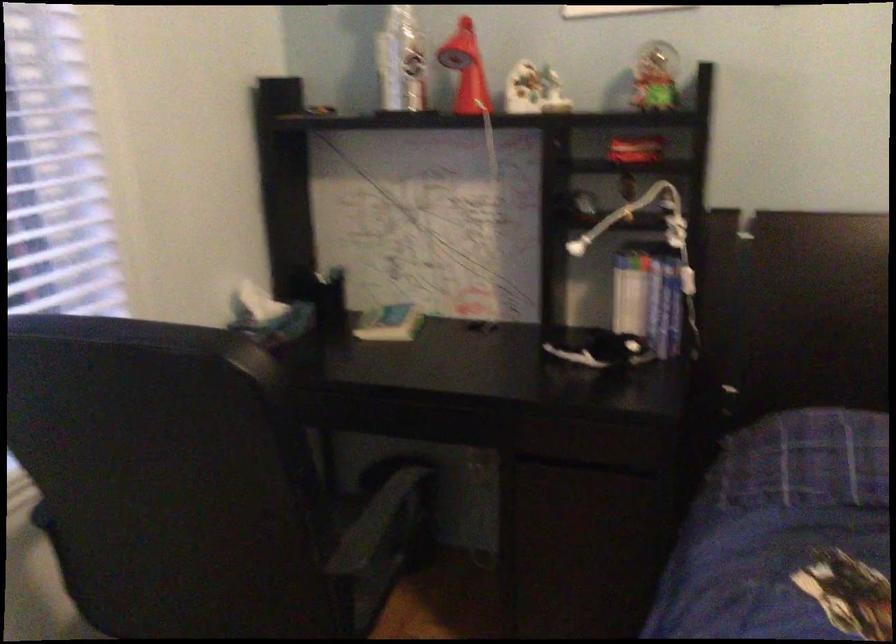
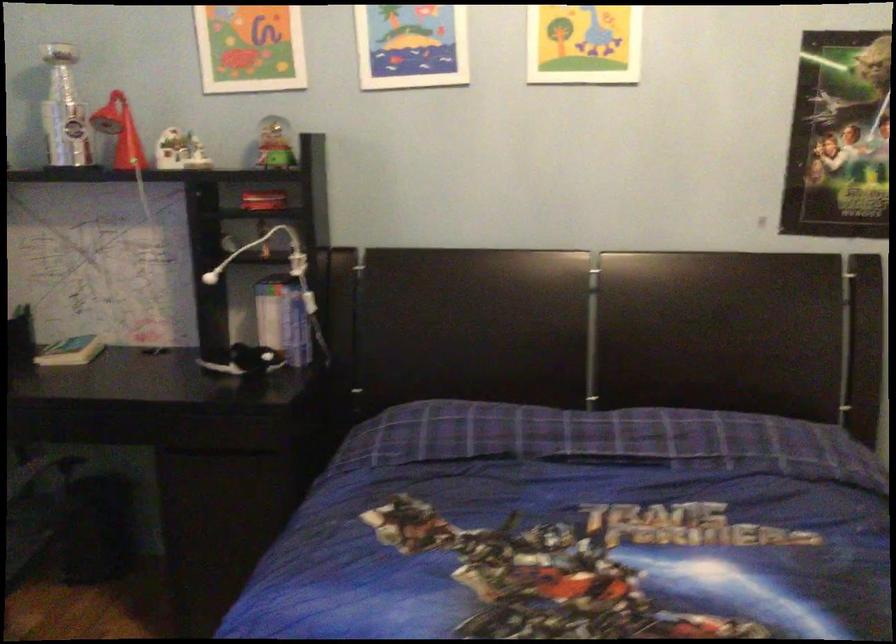
In the second image, find the point that corresponds to (467,68) in the first image.

(119, 131)